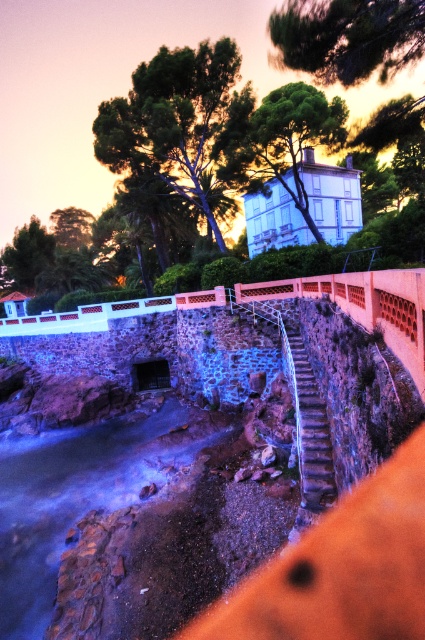
Question: Observing the image, what is the correct spatial positioning of metallic silver stairs at center in reference to rustic stone stairs at center?

Choices:
 (A) below
 (B) above

Answer: (A)

Question: Which object is farther from the camera taking this photo?

Choices:
 (A) rustic stone stairs at center
 (B) translucent glass water at lower left
 (C) green matte tree at upper center
 (D) metallic silver stairs at center

Answer: (C)

Question: Which object appears closest to the camera in this image?

Choices:
 (A) green matte tree at upper center
 (B) metallic silver stairs at center
 (C) green leafy tree at upper center
 (D) rustic stone stairs at center

Answer: (B)

Question: Is the position of green matte tree at upper center more distant than that of metallic silver stairs at center?

Choices:
 (A) no
 (B) yes

Answer: (B)

Question: Is green leafy tree at upper center positioned behind green matte tree at upper center?

Choices:
 (A) no
 (B) yes

Answer: (B)

Question: Which object is farther from the camera taking this photo?

Choices:
 (A) metallic silver stairs at center
 (B) green leafy tree at upper left
 (C) green leafy tree at upper center

Answer: (B)